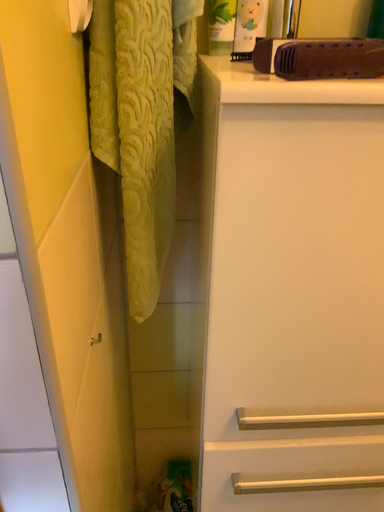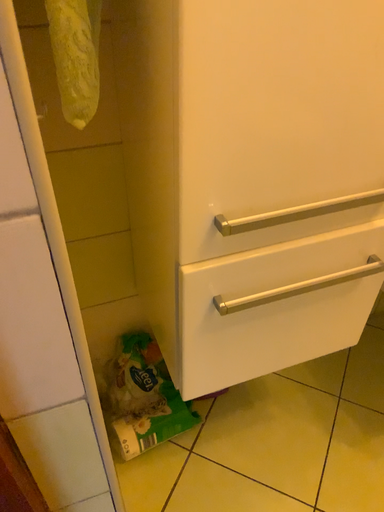
Question: How did the camera likely rotate when shooting the video?

Choices:
 (A) rotated upward
 (B) rotated downward

Answer: (B)